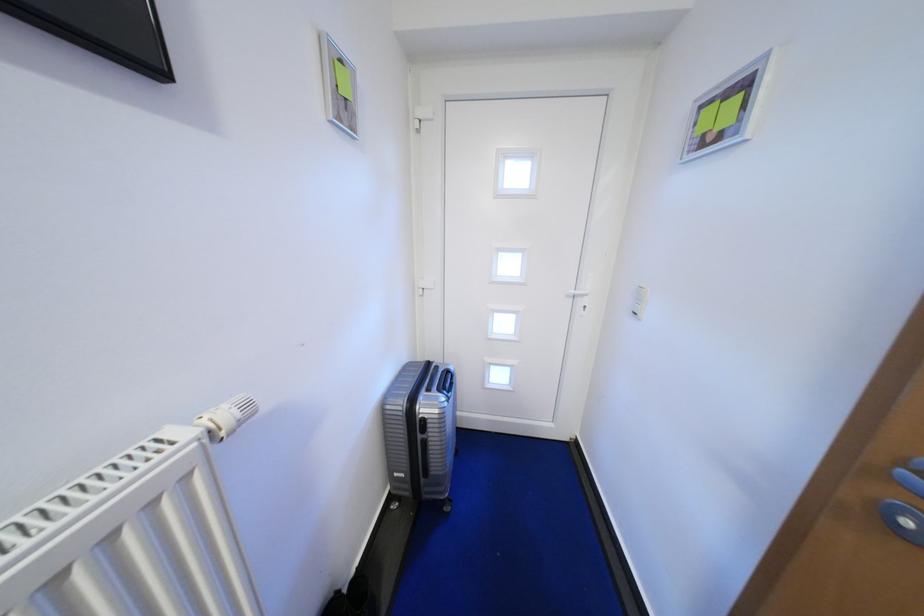
Describe the element at coordinates (226, 416) in the screenshot. I see `a white radiator knob` at that location.